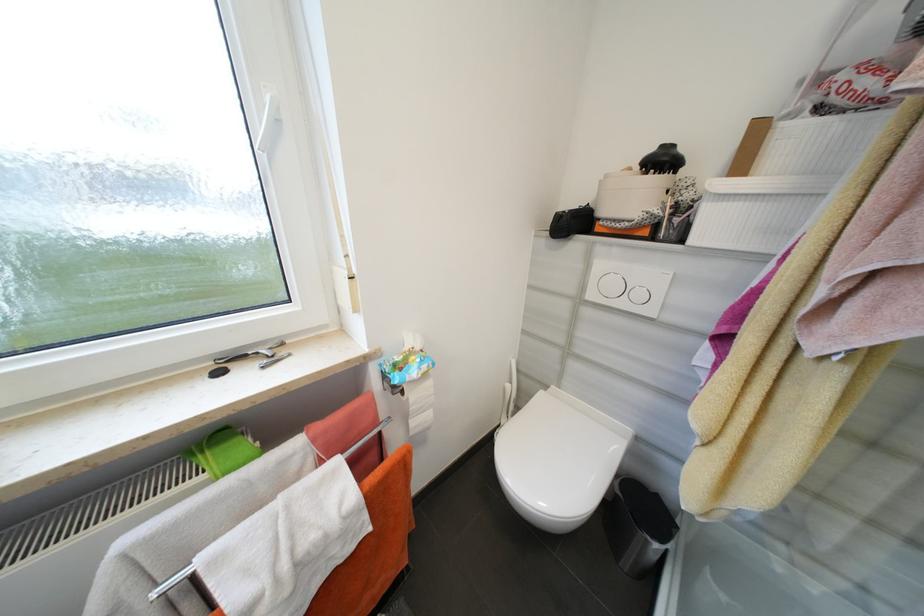
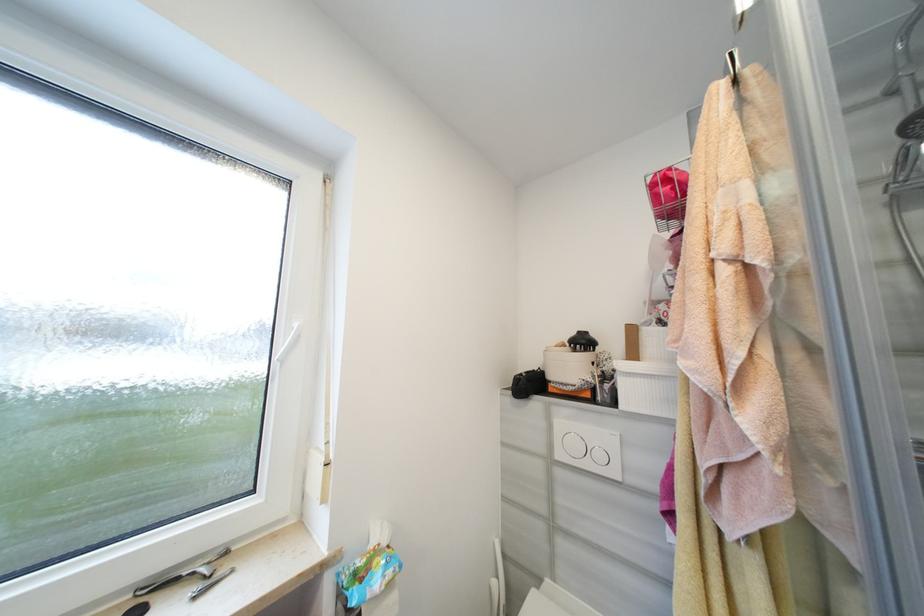
Question: Based on the continuous images, in which direction is the camera rotating? Reply with the corresponding letter.

Choices:
 (A) Left
 (B) Right
 (C) Up
 (D) Down

Answer: (C)